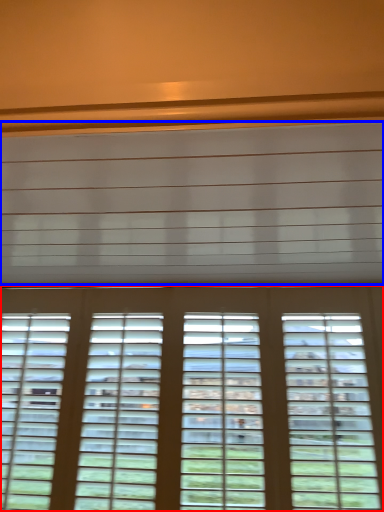
Question: Which object appears closest to the camera in this image, window (highlighted by a red box) or blind (highlighted by a blue box)?

Choices:
 (A) window
 (B) blind

Answer: (B)